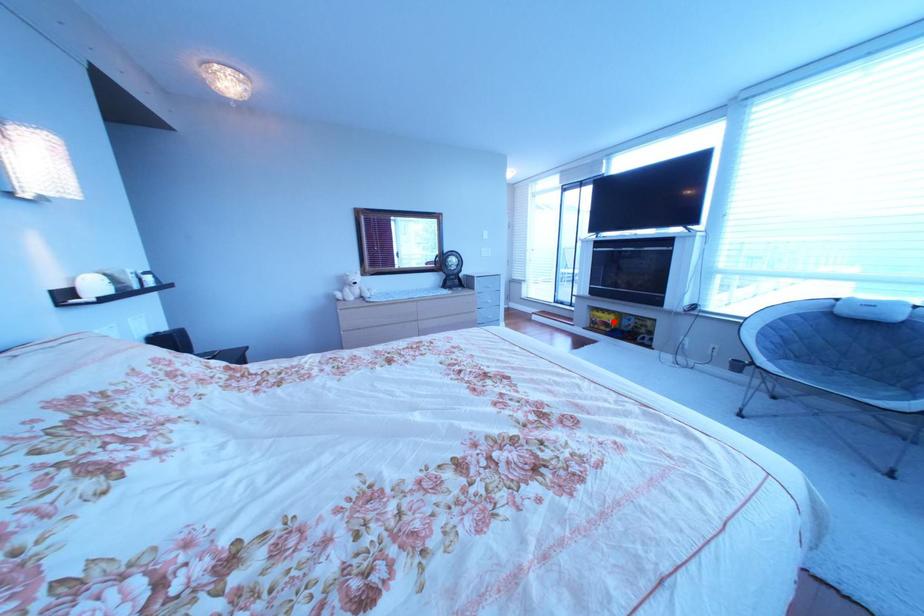
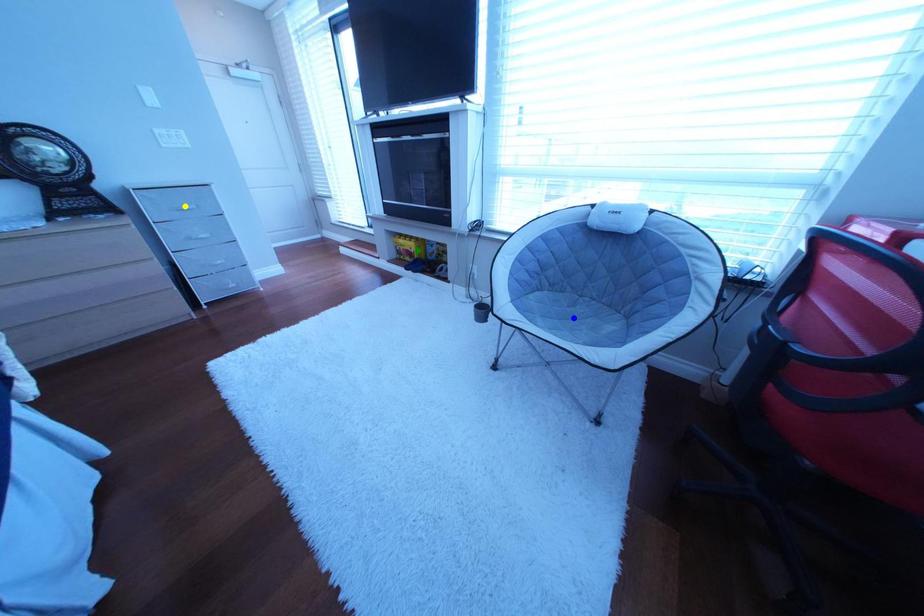
Question: I am providing you with two images of the same scene from different viewpoints. A red point is marked on the first image. You are given multiple points on the second image. Which point in image 2 is actually the same real-world point as the red point in image 1?

Choices:
 (A) blue point
 (B) yellow point
 (C) green point

Answer: (C)